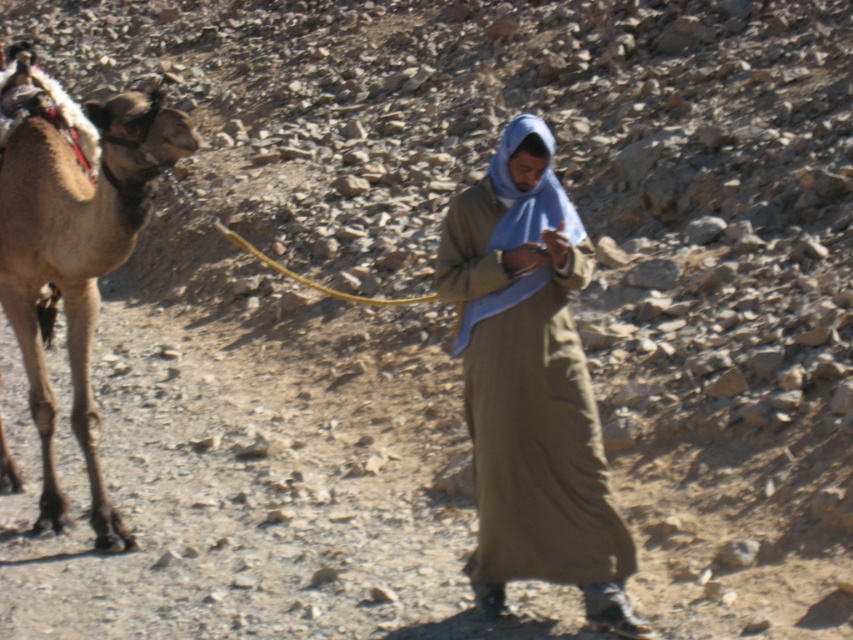
The width and height of the screenshot is (853, 640). I want to click on olive-green fabric robe at center, so click(527, 372).

What do you see at coordinates (527, 372) in the screenshot? I see `olive-green fabric robe at center` at bounding box center [527, 372].

Does point (616, 531) come farther from viewer compared to point (106, 524)?

That is False.

You are a GUI agent. You are given a task and a screenshot of the screen. Output one action in this format:
    pyautogui.click(x=<x>, y=<y>)
    Task: Click on the olive-green fabric robe at center
    The image size is (853, 640).
    Given the screenshot: What is the action you would take?
    pyautogui.click(x=527, y=372)